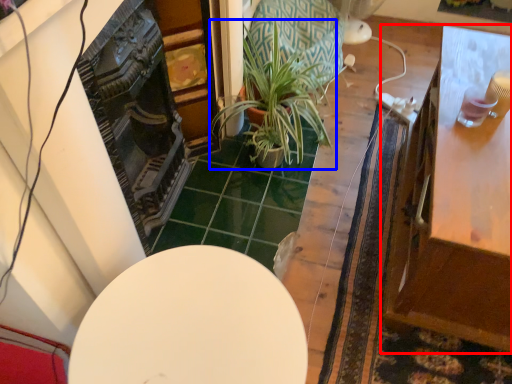
Question: Which object is further to the camera taking this photo, table (highlighted by a red box) or houseplant (highlighted by a blue box)?

Choices:
 (A) table
 (B) houseplant

Answer: (B)